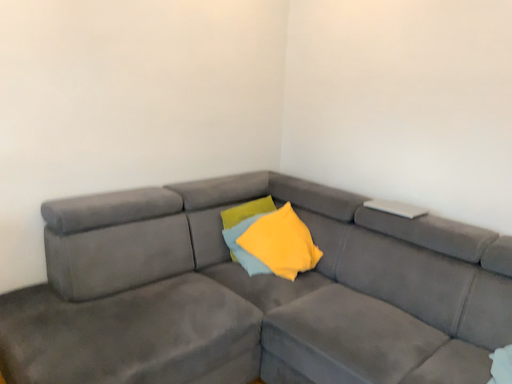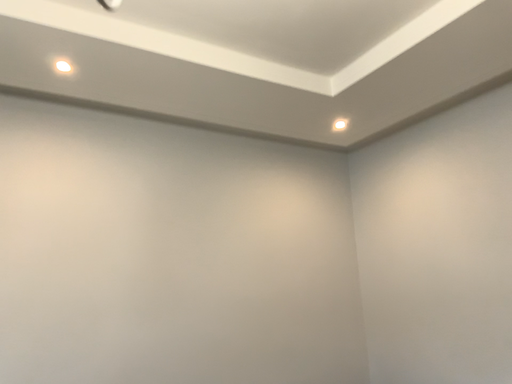
Question: How did the camera likely rotate when shooting the video?

Choices:
 (A) rotated downward
 (B) rotated upward

Answer: (B)